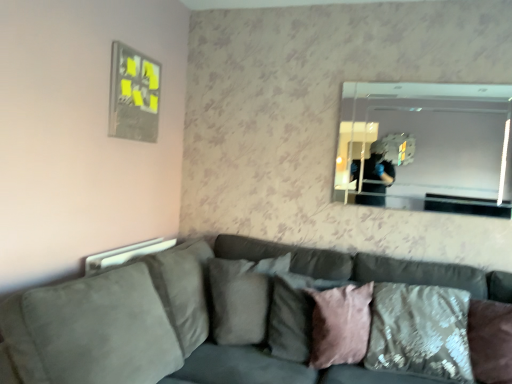
Find the location of a particular element. This screenshot has height=384, width=512. pink velvet pillow at center, arranged as the 2th pillow when viewed from the left is located at coordinates (294, 315).

What is the approximate width of clear glass mirror at upper right?

It is 1.43 inches.

What do you see at coordinates (426, 147) in the screenshot? I see `clear glass mirror at upper right` at bounding box center [426, 147].

Identify the location of pink velvet pillow at center, placed as the 2th pillow when sorted from right to left. Image resolution: width=512 pixels, height=384 pixels. (340, 325).

Image resolution: width=512 pixels, height=384 pixels. I want to click on pink velvet pillow at center, arranged as the 2th pillow when viewed from the left, so click(294, 315).

From a real-world perspective, is suede gray couch at center positioned over pink velvet pillow at center, arranged as the 3th pillow when viewed from the right, based on gravity?

No.

How distant is suede gray couch at center from pink velvet pillow at center, arranged as the 2th pillow when viewed from the left?

suede gray couch at center and pink velvet pillow at center, arranged as the 2th pillow when viewed from the left, are 10.14 inches apart.

Where is `studio couch below the pink velvet pillow at center, arranged as the 3th pillow when viewed from the right (from a real-world perspective)`? studio couch below the pink velvet pillow at center, arranged as the 3th pillow when viewed from the right (from a real-world perspective) is located at coordinates (159, 322).

Considering the relative positions of suede gray couch at center and pink velvet pillow at center, arranged as the 3th pillow when viewed from the right, in the image provided, is suede gray couch at center to the left of pink velvet pillow at center, arranged as the 3th pillow when viewed from the right, from the viewer's perspective?

Yes.

Between point (218, 288) and point (307, 279), which one is positioned behind?

The point (218, 288) is behind.

Between suede-like gray pillow at center, arranged as the 1th pillow when viewed from the left, and pink velvet pillow at center, arranged as the 3th pillow when viewed from the right, which one appears on the right side from the viewer's perspective?

pink velvet pillow at center, arranged as the 3th pillow when viewed from the right.

From a real-world perspective, who is located lower, suede-like gray pillow at center, arranged as the 1th pillow when viewed from the left, or pink velvet pillow at center, arranged as the 2th pillow when viewed from the left?

In real-world perspective, pink velvet pillow at center, arranged as the 2th pillow when viewed from the left, is lower.

Considering the positions of objects suede-like gray pillow at center, arranged as the 1th pillow when viewed from the left, and pink velvet pillow at center, arranged as the 2th pillow when viewed from the left, in the image provided, who is in front, suede-like gray pillow at center, arranged as the 1th pillow when viewed from the left, or pink velvet pillow at center, arranged as the 2th pillow when viewed from the left,?

pink velvet pillow at center, arranged as the 2th pillow when viewed from the left, is closer to the camera.

Based on the photo, is metallic silver picture frame at upper left far from clear glass mirror at upper right?

Yes, metallic silver picture frame at upper left and clear glass mirror at upper right are quite far apart.

From the image's perspective, who appears lower, metallic silver picture frame at upper left or clear glass mirror at upper right?

clear glass mirror at upper right, from the image's perspective.

Can you confirm if metallic silver picture frame at upper left is shorter than clear glass mirror at upper right?

Indeed, metallic silver picture frame at upper left has a lesser height compared to clear glass mirror at upper right.

Considering the positions of objects metallic silver picture frame at upper left and clear glass mirror at upper right in the image provided, who is in front, metallic silver picture frame at upper left or clear glass mirror at upper right?

Positioned in front is metallic silver picture frame at upper left.

Who is smaller, clear glass mirror at upper right or pink velvet pillow at center, arranged as the 3th pillow when viewed from the right?

clear glass mirror at upper right.

Is clear glass mirror at upper right shorter than pink velvet pillow at center, arranged as the 3th pillow when viewed from the right?

Incorrect, the height of clear glass mirror at upper right does not fall short of that of pink velvet pillow at center, arranged as the 3th pillow when viewed from the right.

In the image, there is a pink velvet pillow at center, arranged as the 2th pillow when viewed from the left. Where is `mirror above it (from the image's perspective)`? mirror above it (from the image's perspective) is located at coordinates (426, 147).

Could you tell me if clear glass mirror at upper right is facing pink velvet pillow at center, arranged as the 3th pillow when viewed from the right?

No, clear glass mirror at upper right is not oriented towards pink velvet pillow at center, arranged as the 3th pillow when viewed from the right.

Which object is further away from the camera, pink velvet pillow at center, arranged as the 2th pillow when viewed from the left, or metallic silver picture frame at upper left?

metallic silver picture frame at upper left.

Considering the sizes of pink velvet pillow at center, arranged as the 3th pillow when viewed from the right, and metallic silver picture frame at upper left in the image, is pink velvet pillow at center, arranged as the 3th pillow when viewed from the right, taller or shorter than metallic silver picture frame at upper left?

Considering their sizes, pink velvet pillow at center, arranged as the 3th pillow when viewed from the right, has less height than metallic silver picture frame at upper left.

Is point (304, 300) closer or farther from the camera than point (153, 142)?

Point (304, 300).

Is pink velvet pillow at center, arranged as the 2th pillow when viewed from the left, to the right of metallic silver picture frame at upper left from the viewer's perspective?

Indeed, pink velvet pillow at center, arranged as the 2th pillow when viewed from the left, is positioned on the right side of metallic silver picture frame at upper left.

From the image's perspective, which is below, clear glass mirror at upper right or suede-like gray pillow at center, arranged as the 4th pillow when viewed from the right?

From the image's view, suede-like gray pillow at center, arranged as the 4th pillow when viewed from the right, is below.

Can you confirm if clear glass mirror at upper right is wider than suede-like gray pillow at center, arranged as the 4th pillow when viewed from the right?

In fact, clear glass mirror at upper right might be narrower than suede-like gray pillow at center, arranged as the 4th pillow when viewed from the right.

Identify the location of mirror lying behind the suede-like gray pillow at center, arranged as the 1th pillow when viewed from the left. The width and height of the screenshot is (512, 384). (426, 147).

Looking at this image, how far apart are clear glass mirror at upper right and suede-like gray pillow at center, arranged as the 1th pillow when viewed from the left?

They are 3.58 feet apart.

Is point (250, 280) less distant than point (444, 371)?

No, it is behind (444, 371).

Between suede-like gray pillow at center, arranged as the 4th pillow when viewed from the right, and velvet textured pillow at lower right, marked as the 1th pillow in a right-to-left arrangement, which one appears on the left side from the viewer's perspective?

suede-like gray pillow at center, arranged as the 4th pillow when viewed from the right.

From the picture: Between suede-like gray pillow at center, arranged as the 1th pillow when viewed from the left, and velvet textured pillow at lower right, the 4th pillow in the left-to-right sequence, which one has larger size?

velvet textured pillow at lower right, the 4th pillow in the left-to-right sequence.

At what (x,y) coordinates should I click in order to perform the action: click on the 3rd pillow above the suede gray couch at center (from the image's perspective). Please return your answer as a coordinate pair (x, y). This screenshot has height=384, width=512. Looking at the image, I should click on pos(294,315).

This screenshot has width=512, height=384. I want to click on pillow that appears above the pink velvet pillow at center, arranged as the 3th pillow when viewed from the right (from a real-world perspective), so click(x=238, y=302).

In the scene shown: Estimate the real-world distances between objects in this image. Which object is further from metallic silver picture frame at upper left, velvet textured pillow at lower right, marked as the 1th pillow in a right-to-left arrangement, or suede-like gray pillow at center, arranged as the 4th pillow when viewed from the right?

velvet textured pillow at lower right, marked as the 1th pillow in a right-to-left arrangement, is positioned further to the anchor metallic silver picture frame at upper left.

Estimate the real-world distances between objects in this image. Which object is further from metallic silver picture frame at upper left, suede-like gray pillow at center, arranged as the 1th pillow when viewed from the left, or pink velvet pillow at center, arranged as the 3th pillow when viewed from the right?

pink velvet pillow at center, arranged as the 3th pillow when viewed from the right.

When comparing their distances from suede gray couch at center, does suede-like gray pillow at center, arranged as the 4th pillow when viewed from the right, or velvet textured pillow at lower right, the 4th pillow in the left-to-right sequence, seem closer?

suede-like gray pillow at center, arranged as the 4th pillow when viewed from the right.

Estimate the real-world distances between objects in this image. Which object is closer to metallic silver picture frame at upper left, pink velvet pillow at center, placed as the 2th pillow when sorted from right to left, or pink velvet pillow at center, arranged as the 2th pillow when viewed from the left?

Based on the image, pink velvet pillow at center, arranged as the 2th pillow when viewed from the left, appears to be nearer to metallic silver picture frame at upper left.

When comparing their distances from metallic silver picture frame at upper left, does pink velvet pillow at center, arranged as the 2th pillow when viewed from the left, or velvet textured pillow at lower right, the 4th pillow in the left-to-right sequence, seem further?

velvet textured pillow at lower right, the 4th pillow in the left-to-right sequence, lies further to metallic silver picture frame at upper left than the other object.

From the image, which object appears to be farther from velvet textured pillow at lower right, the 4th pillow in the left-to-right sequence, suede gray couch at center or pink velvet pillow at center, the 3th pillow from the left?

Among the two, suede gray couch at center is located further to velvet textured pillow at lower right, the 4th pillow in the left-to-right sequence.

Based on their spatial positions, is suede gray couch at center or clear glass mirror at upper right further from metallic silver picture frame at upper left?

clear glass mirror at upper right lies further to metallic silver picture frame at upper left than the other object.

From the image, which object appears to be nearer to pink velvet pillow at center, arranged as the 3th pillow when viewed from the right, suede-like gray pillow at center, arranged as the 1th pillow when viewed from the left, or suede gray couch at center?

Among the two, suede-like gray pillow at center, arranged as the 1th pillow when viewed from the left, is located nearer to pink velvet pillow at center, arranged as the 3th pillow when viewed from the right.

Where is `pillow between suede gray couch at center and pink velvet pillow at center, placed as the 2th pillow when sorted from right to left, from front to back`? The width and height of the screenshot is (512, 384). pillow between suede gray couch at center and pink velvet pillow at center, placed as the 2th pillow when sorted from right to left, from front to back is located at coordinates (420, 331).

This screenshot has width=512, height=384. Identify the location of pillow that lies between metallic silver picture frame at upper left and pink velvet pillow at center, arranged as the 2th pillow when viewed from the left, from top to bottom. (238, 302).

At what (x,y) coordinates should I click in order to perform the action: click on picture frame positioned between suede gray couch at center and clear glass mirror at upper right from near to far. Please return your answer as a coordinate pair (x, y). This screenshot has width=512, height=384. Looking at the image, I should click on (133, 95).

This screenshot has width=512, height=384. In order to click on pillow situated between suede-like gray pillow at center, arranged as the 4th pillow when viewed from the right, and pink velvet pillow at center, placed as the 2th pillow when sorted from right to left, from left to right in this screenshot , I will do `click(294, 315)`.